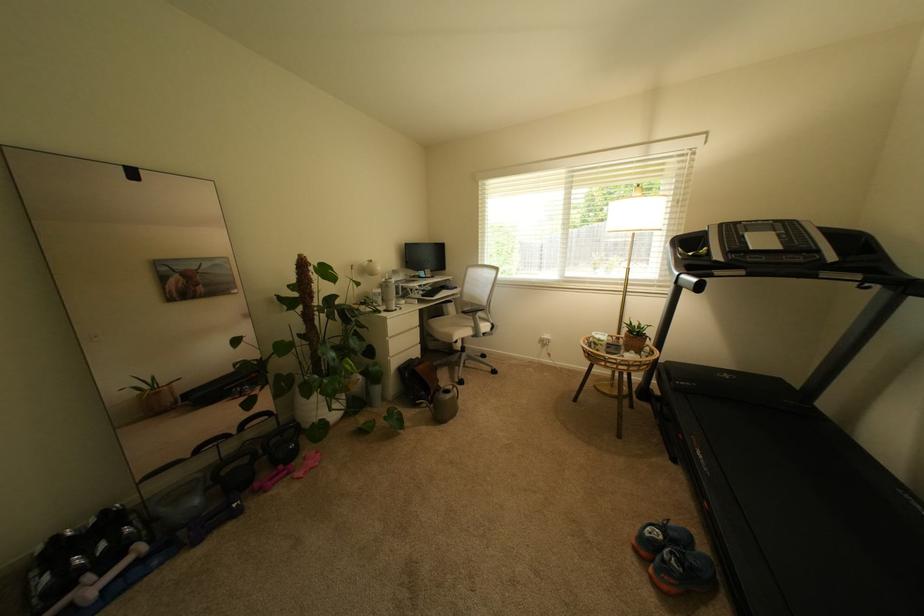
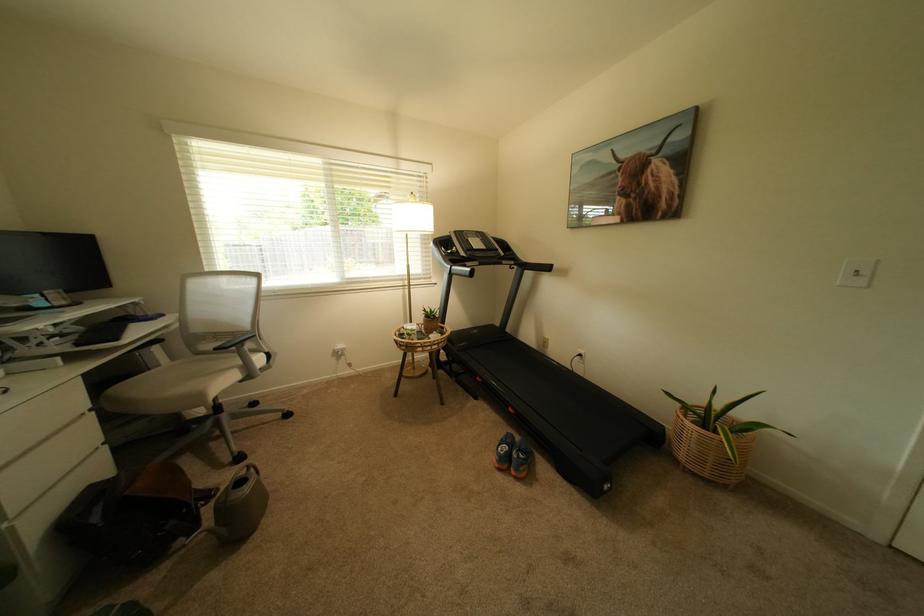
Find the pixel in the second image that matches point (452, 315) in the first image.

(157, 370)